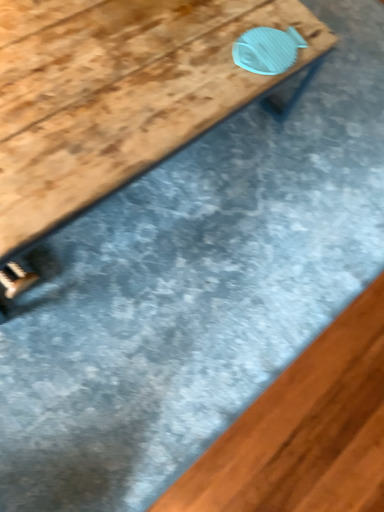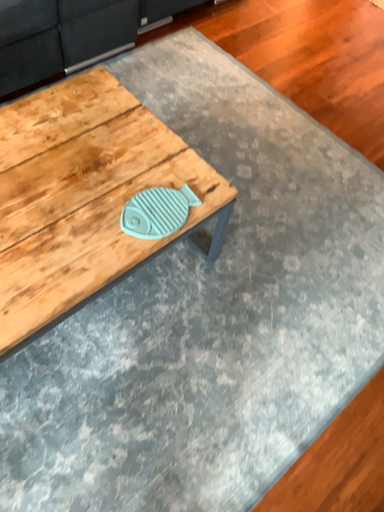
Question: Which way did the camera rotate in the video?

Choices:
 (A) rotated upward
 (B) rotated downward

Answer: (A)